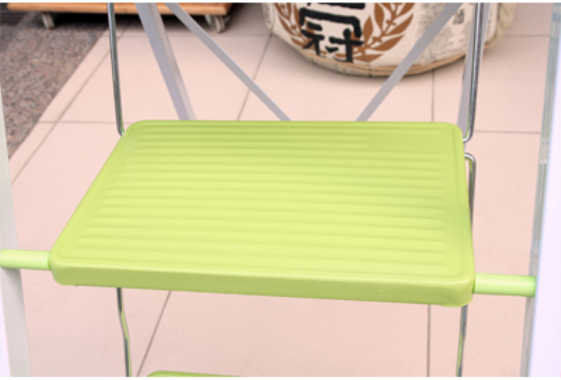
Identify the location of chair seat. The width and height of the screenshot is (561, 380). (266, 252).